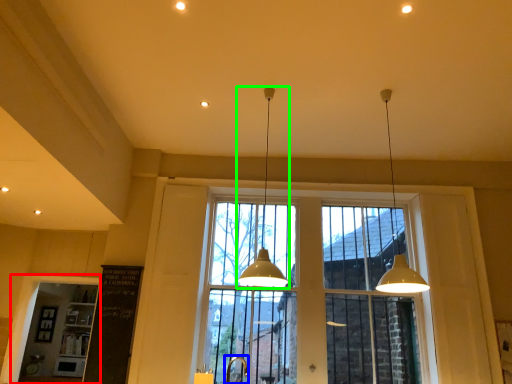
Question: Estimate the real-world distances between objects in this image. Which object is farther from window frame (highlighted by a red box), faucet (highlighted by a blue box) or lamp (highlighted by a green box)?

Choices:
 (A) faucet
 (B) lamp

Answer: (B)